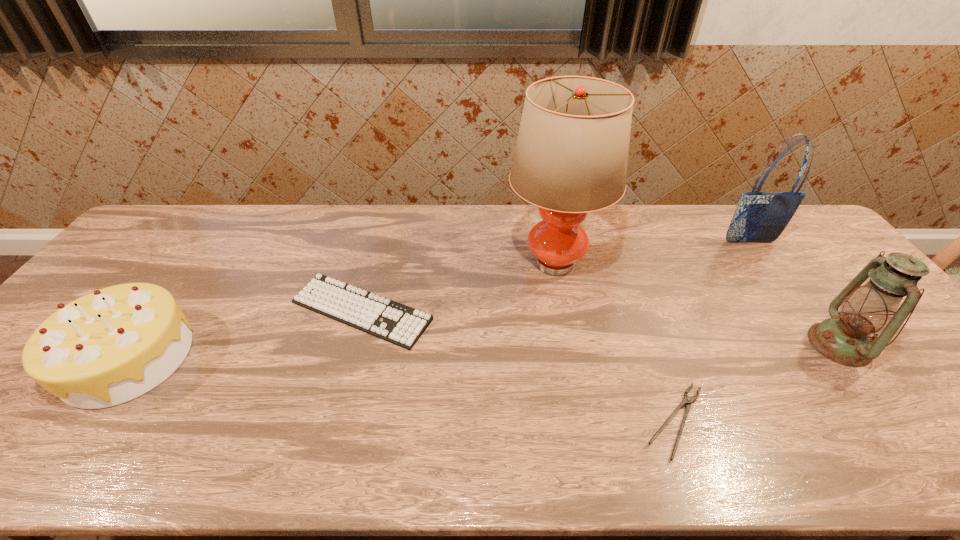
Where is `free space between the birthday cake and the computer keyboard`? Image resolution: width=960 pixels, height=540 pixels. free space between the birthday cake and the computer keyboard is located at coordinates (245, 334).

The height and width of the screenshot is (540, 960). What are the coordinates of `vacant space in between the shopping bag and the third shortest object` in the screenshot? It's located at (439, 300).

This screenshot has width=960, height=540. Identify the location of vacant area between the fifth tallest object and the tallest object. (458, 286).

In order to click on vacant area that lies between the fifth object from right to left and the birthday cake in this screenshot , I will do `click(245, 334)`.

In order to click on free space between the third shortest object and the shopping bag in this screenshot , I will do `click(439, 300)`.

The height and width of the screenshot is (540, 960). In order to click on vacant space in between the fifth shortest object and the fourth tallest object in this screenshot , I will do `click(439, 300)`.

Locate an element on the screen. object that is the fifth closest one to the third shortest object is located at coordinates (845, 338).

The width and height of the screenshot is (960, 540). What are the coordinates of `object identified as the closest to the tallest object` in the screenshot? It's located at (391, 321).

At what (x,y) coordinates should I click in order to perform the action: click on vacant space that satisfies the following two spatial constraints: 1. on the front side of the third shortest object; 2. on the left side of the tongs. Please return your answer as a coordinate pair (x, y). This screenshot has height=540, width=960. Looking at the image, I should click on (84, 421).

This screenshot has width=960, height=540. What are the coordinates of `vacant space that satisfies the following two spatial constraints: 1. on the front side of the second object from left to right; 2. on the right side of the third tallest object` in the screenshot? It's located at (352, 345).